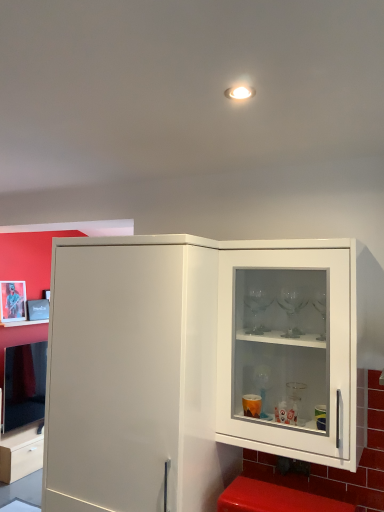
Question: Considering the relative sizes of metallic silver picture frame at upper left and red plastic step stool at lower right in the image provided, is metallic silver picture frame at upper left bigger than red plastic step stool at lower right?

Choices:
 (A) no
 (B) yes

Answer: (A)

Question: From the image's perspective, is metallic silver picture frame at upper left located above red plastic step stool at lower right?

Choices:
 (A) no
 (B) yes

Answer: (B)

Question: Does metallic silver picture frame at upper left turn towards red plastic step stool at lower right?

Choices:
 (A) no
 (B) yes

Answer: (A)

Question: Is the position of metallic silver picture frame at upper left less distant than that of red plastic step stool at lower right?

Choices:
 (A) yes
 (B) no

Answer: (B)

Question: Can you confirm if metallic silver picture frame at upper left is taller than red plastic step stool at lower right?

Choices:
 (A) no
 (B) yes

Answer: (B)

Question: Is metallic silver picture frame at upper left looking in the opposite direction of red plastic step stool at lower right?

Choices:
 (A) yes
 (B) no

Answer: (B)

Question: Is white glossy cabinet door at center located within metallic silver picture frame at upper left?

Choices:
 (A) no
 (B) yes

Answer: (A)

Question: From the image's perspective, would you say metallic silver picture frame at upper left is positioned over white glossy cabinet door at center?

Choices:
 (A) no
 (B) yes

Answer: (B)

Question: Is metallic silver picture frame at upper left taller than white glossy cabinet door at center?

Choices:
 (A) no
 (B) yes

Answer: (A)

Question: Is metallic silver picture frame at upper left not inside white glossy cabinet door at center?

Choices:
 (A) no
 (B) yes

Answer: (B)

Question: From a real-world perspective, is metallic silver picture frame at upper left beneath white glossy cabinet door at center?

Choices:
 (A) yes
 (B) no

Answer: (B)

Question: From a real-world perspective, is metallic silver picture frame at upper left on white glossy cabinet door at center?

Choices:
 (A) no
 (B) yes

Answer: (B)

Question: Is white glossy cabinet at right positioned with its back to metallic silver picture frame at upper left?

Choices:
 (A) no
 (B) yes

Answer: (A)